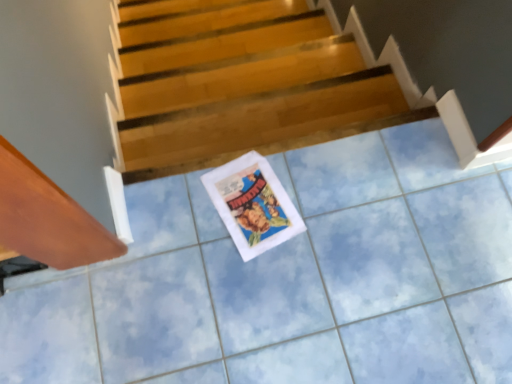
I want to click on empty space that is ontop of white paper comic book at center (from a real-world perspective), so click(252, 204).